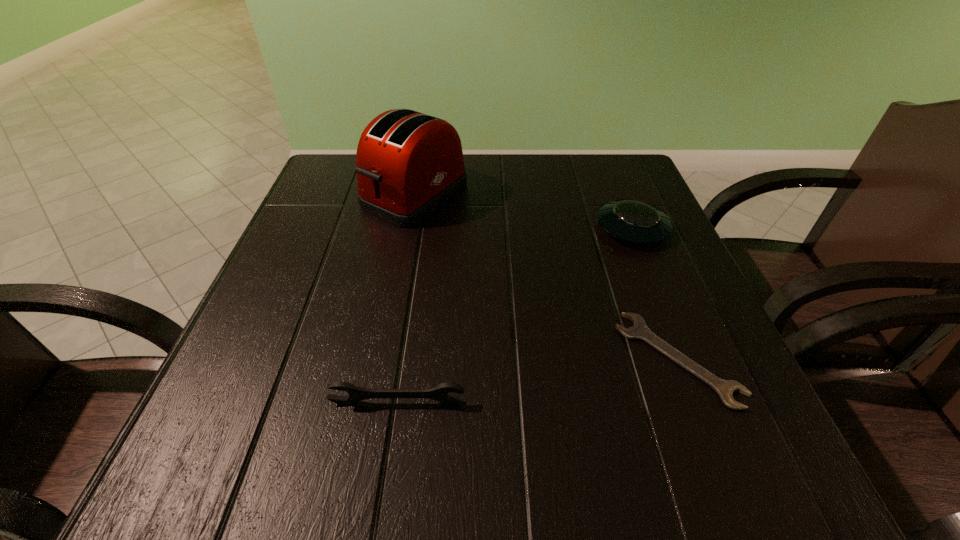
The height and width of the screenshot is (540, 960). What are the coordinates of `vacant area between the shorter wrench and the tallest object` in the screenshot? It's located at (546, 277).

Find the location of `blank region between the toaster and the shorter wrench`. blank region between the toaster and the shorter wrench is located at coordinates (546, 277).

Find the location of a particular element. This screenshot has height=540, width=960. free space between the shorter wrench and the saucer is located at coordinates (655, 294).

This screenshot has height=540, width=960. I want to click on free space that is in between the tallest object and the saucer, so click(x=523, y=212).

Identify the location of vacant area between the taller wrench and the toaster. The image size is (960, 540). (406, 299).

Locate an element on the screen. free spot between the tallest object and the saucer is located at coordinates (523, 212).

You are a GUI agent. You are given a task and a screenshot of the screen. Output one action in this format:
    pyautogui.click(x=<x>, y=<y>)
    Task: Click on the free space between the tallest object and the shorter wrench
    This screenshot has height=540, width=960.
    Given the screenshot: What is the action you would take?
    pyautogui.click(x=546, y=277)

The width and height of the screenshot is (960, 540). I want to click on empty space that is in between the tallest object and the saucer, so click(x=523, y=212).

Locate an element on the screen. free space between the saucer and the taller wrench is located at coordinates (515, 315).

Identify which object is the closest to the shorter wrench. Please provide its 2D coordinates. Your answer should be formatted as a tuple, i.e. [(x, y)], where the tuple contains the x and y coordinates of a point satisfying the conditions above.

[(633, 221)]